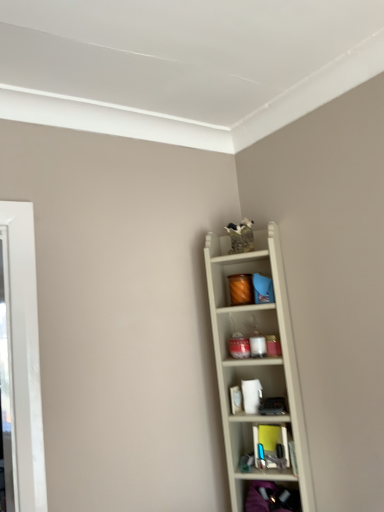
Question: Based on their positions, is white wood shelf at upper right, the first shelf in the top-to-bottom sequence, located to the left or right of matte black shoes at lower right, the second shelf from the top?

Choices:
 (A) right
 (B) left

Answer: (B)

Question: From the image's perspective, is white wood shelf at upper right, the 2th shelf ordered from the bottom, located above or below matte black shoes at lower right, the second shelf from the top?

Choices:
 (A) above
 (B) below

Answer: (A)

Question: Is white wood shelf at upper right, the 2th shelf ordered from the bottom, spatially inside matte black shoes at lower right, the 1th shelf in the bottom-to-top sequence, or outside of it?

Choices:
 (A) outside
 (B) inside

Answer: (A)

Question: Is matte black shoes at lower right, the second shelf from the top, in front of or behind white wood shelf at upper right, the first shelf in the top-to-bottom sequence, in the image?

Choices:
 (A) front
 (B) behind

Answer: (A)

Question: Is matte black shoes at lower right, the 1th shelf in the bottom-to-top sequence, bigger or smaller than white wood shelf at upper right, the first shelf in the top-to-bottom sequence?

Choices:
 (A) big
 (B) small

Answer: (B)

Question: From the image's perspective, is matte black shoes at lower right, the 1th shelf in the bottom-to-top sequence, located above or below white wood shelf at upper right, the 2th shelf ordered from the bottom?

Choices:
 (A) below
 (B) above

Answer: (A)

Question: Does point (279, 500) appear closer or farther from the camera than point (297, 393)?

Choices:
 (A) closer
 (B) farther

Answer: (A)